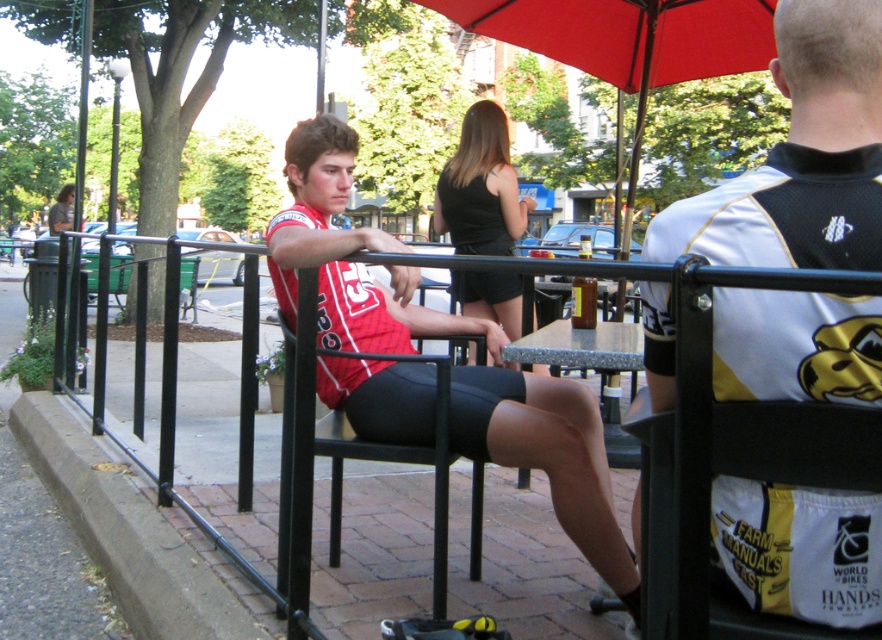
Between black metal fence at left and matte black shirt at upper left, which one is positioned lower?

black metal fence at left is below.

Is point (305, 266) positioned behind point (70, 189)?

No, it is in front of (70, 189).

Who is more distant from viewer, (312, 342) or (72, 198)?

Point (72, 198)

Where is `black metal fence at left`? The height and width of the screenshot is (640, 882). black metal fence at left is located at coordinates (744, 422).

Can you confirm if black matte dress at center is positioned above matte black shirt at upper left?

Actually, black matte dress at center is below matte black shirt at upper left.

Does point (510, 326) come farther from viewer compared to point (58, 225)?

No.

Image resolution: width=882 pixels, height=640 pixels. In order to click on black matte dress at center in this screenshot , I will do `click(480, 188)`.

Which of these two, white mesh shirt at center or black metal chair at center, stands taller?

white mesh shirt at center is taller.

Is point (791, 164) in front of point (443, 465)?

Yes, it is in front of point (443, 465).

This screenshot has height=640, width=882. What do you see at coordinates (801, 157) in the screenshot?
I see `white mesh shirt at center` at bounding box center [801, 157].

Identify the location of white mesh shirt at center. (801, 157).